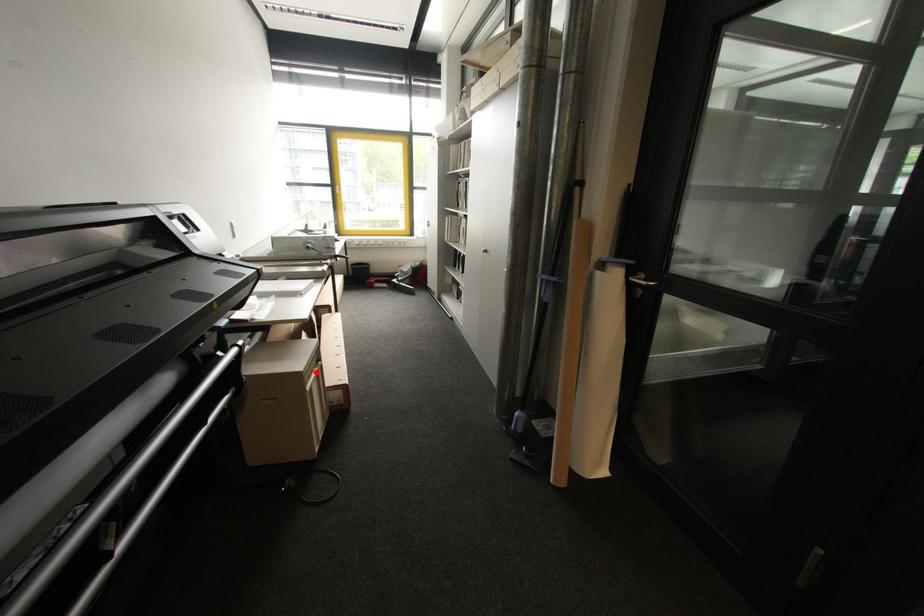
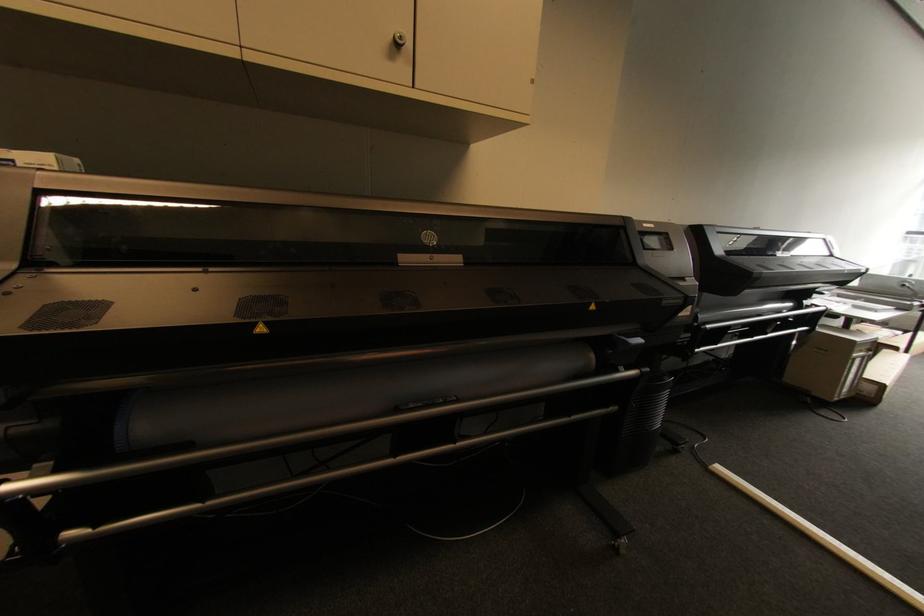
Locate, in the second image, the point that corresponds to the highlighted location in the first image.

(867, 352)